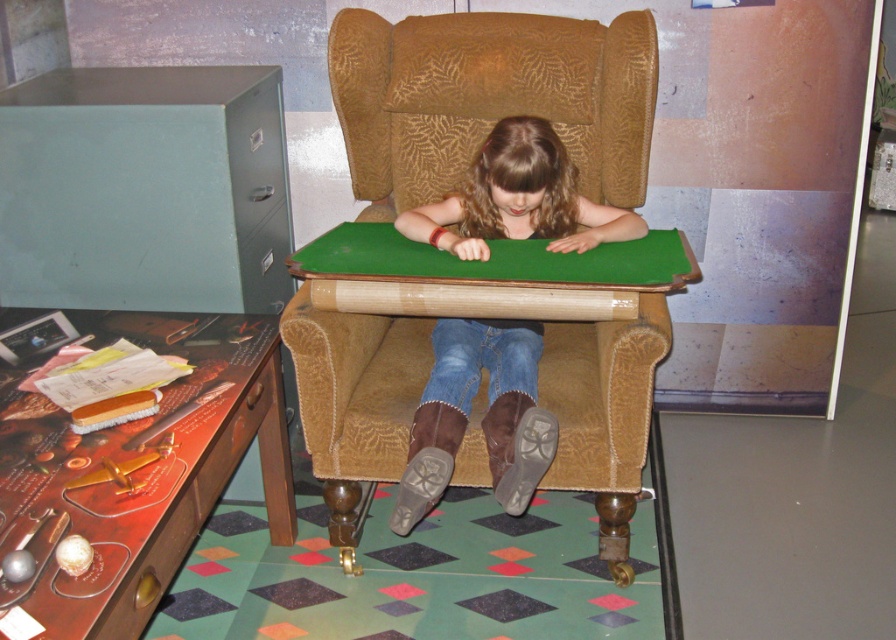
You are standing in the room and see two points marked in the image. The first point is at coordinates point (134, 616) and the second is at point (464, 412). Which point is closer to you?

Point (134, 616) is in front of point (464, 412), so it is closer to you.

In the scene shown: You are a photographer trying to capture the girl in the denim jeans at center from the perspective of the small wooden table with items to the left of the chair. Can you see the brown textured armchair at center blocking your view?

The brown textured armchair at center is to the left of denim jeans at center, so from the perspective of the small wooden table to the left of the chair, the armchair would block the view of the denim jeans at center.

You are a toy airplane that wants to land on either the wooden desk at lower left or the denim jeans at center. Which surface has a wider base for a safe landing?

The denim jeans at center has a wider base than the wooden desk at lower left, so it would provide a safer landing surface for the toy airplane.